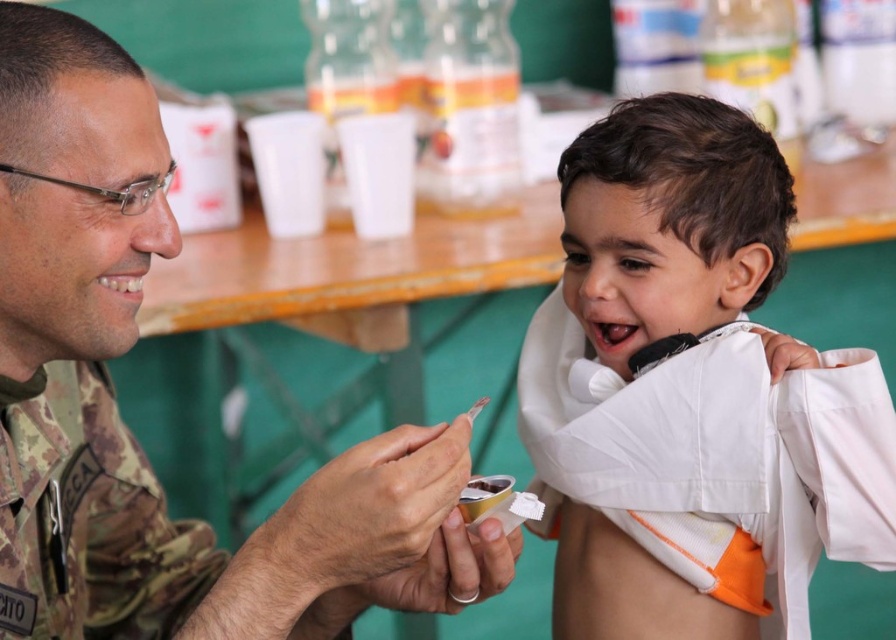
Locate an element on the screen. The image size is (896, 640). white cotton shirt at center is located at coordinates (692, 394).

Measure the distance between white cotton shirt at center and camera.

A distance of 38.07 inches exists between white cotton shirt at center and camera.

Identify the location of white cotton shirt at center. The height and width of the screenshot is (640, 896). (692, 394).

Can you confirm if white cotton shirt at center is positioned below camouflage uniform at left?

Indeed, white cotton shirt at center is positioned under camouflage uniform at left.

Can you confirm if white cotton shirt at center is wider than camouflage uniform at left?

Incorrect, white cotton shirt at center's width does not surpass camouflage uniform at left's.

Who is more forward, (727,225) or (360,582)?

Point (360,582) is in front.

Find the location of a particular element. white cotton shirt at center is located at coordinates (692, 394).

Looking at this image, does camouflage uniform at left lie behind camo fabric uniform at left?

No.

Is camouflage uniform at left positioned before camo fabric uniform at left?

Yes, it is in front of camo fabric uniform at left.

Is point (162, 550) farther from viewer compared to point (152, 493)?

No, it is in front of (152, 493).

Locate an element on the screen. camouflage uniform at left is located at coordinates (126, 428).